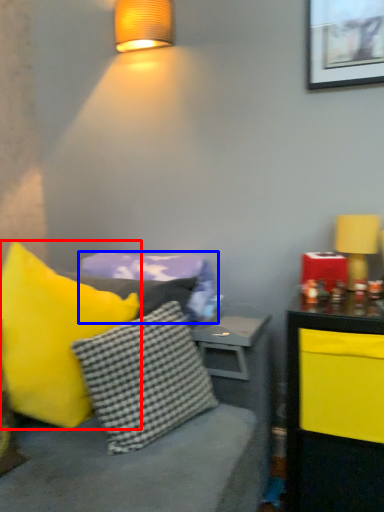
Question: Which of the following is the closest to the observer, pillow (highlighted by a red box) or pillow (highlighted by a blue box)?

Choices:
 (A) pillow
 (B) pillow

Answer: (A)